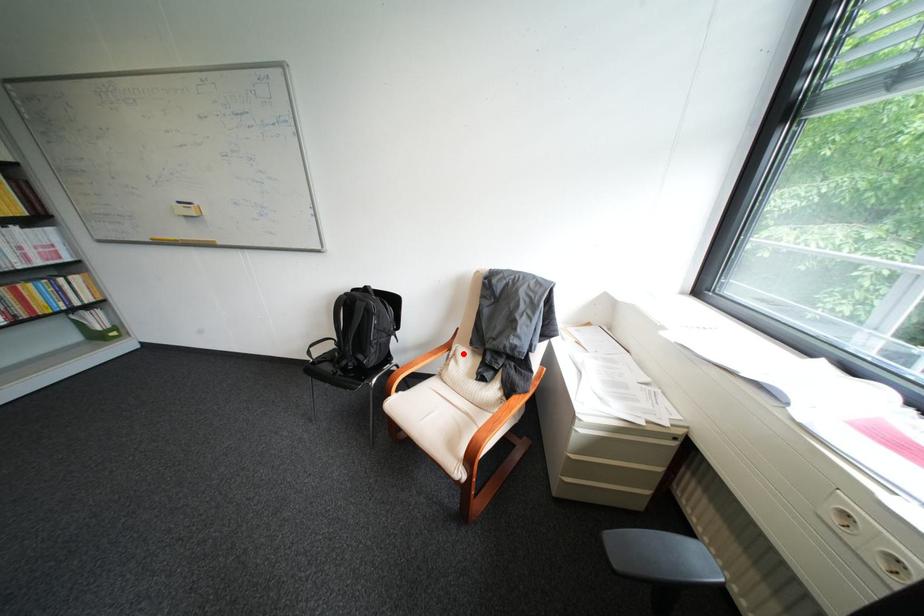
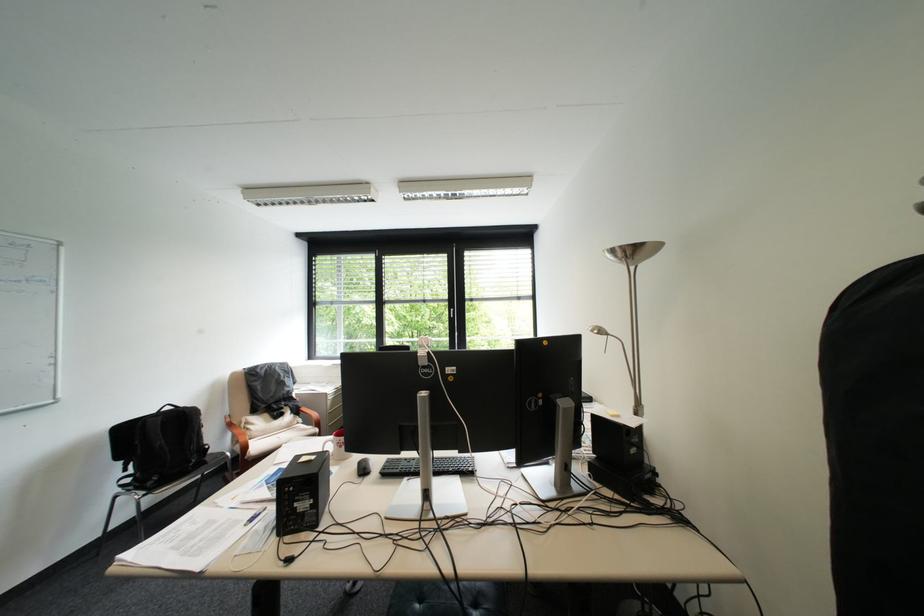
Find the pixel in the second image that matches the highlighted location in the first image.

(256, 424)